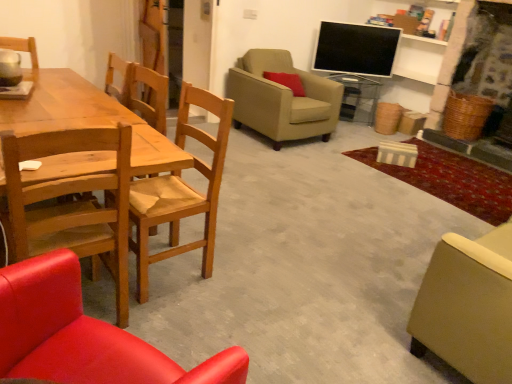
You are a GUI agent. You are given a task and a screenshot of the screen. Output one action in this format:
    pyautogui.click(x=<x>, y=<y>)
    Task: Click on the free space in front of wooden chair at left, which is counted as the fourth chair, starting from the front
    
    Given the screenshot: What is the action you would take?
    pyautogui.click(x=183, y=316)